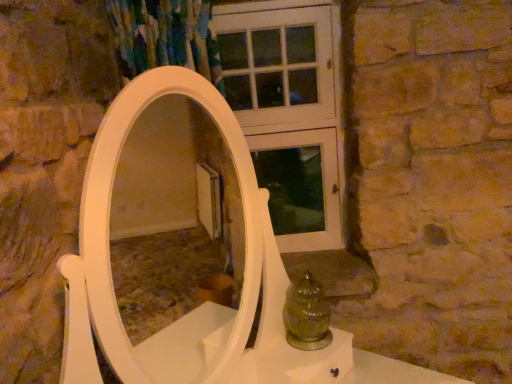
Question: Is amber glass jar at lower center at the right side of white wooden screen door at upper center?

Choices:
 (A) no
 (B) yes

Answer: (B)

Question: Can you confirm if amber glass jar at lower center is shorter than white wooden screen door at upper center?

Choices:
 (A) yes
 (B) no

Answer: (A)

Question: From the image's perspective, is amber glass jar at lower center above white wooden screen door at upper center?

Choices:
 (A) no
 (B) yes

Answer: (A)

Question: Can you confirm if amber glass jar at lower center is positioned to the left of white wooden screen door at upper center?

Choices:
 (A) no
 (B) yes

Answer: (A)

Question: Considering the relative sizes of amber glass jar at lower center and white wooden screen door at upper center in the image provided, is amber glass jar at lower center smaller than white wooden screen door at upper center?

Choices:
 (A) yes
 (B) no

Answer: (A)

Question: Does amber glass jar at lower center come in front of white wooden screen door at upper center?

Choices:
 (A) no
 (B) yes

Answer: (B)

Question: Can you confirm if white wooden screen door at upper center is bigger than amber glass jar at lower center?

Choices:
 (A) no
 (B) yes

Answer: (B)

Question: Is white wooden screen door at upper center thinner than amber glass jar at lower center?

Choices:
 (A) no
 (B) yes

Answer: (B)

Question: Is white wooden screen door at upper center not close to amber glass jar at lower center?

Choices:
 (A) yes
 (B) no

Answer: (B)

Question: From a real-world perspective, is white wooden screen door at upper center positioned under amber glass jar at lower center based on gravity?

Choices:
 (A) yes
 (B) no

Answer: (B)

Question: Is amber glass jar at lower center completely or partially inside white wooden screen door at upper center?

Choices:
 (A) yes
 (B) no

Answer: (B)

Question: From the image's perspective, does white wooden screen door at upper center appear lower than amber glass jar at lower center?

Choices:
 (A) yes
 (B) no

Answer: (B)

Question: Would you say white wooden screen door at upper center is to the left or to the right of amber glass jar at lower center in the picture?

Choices:
 (A) right
 (B) left

Answer: (B)